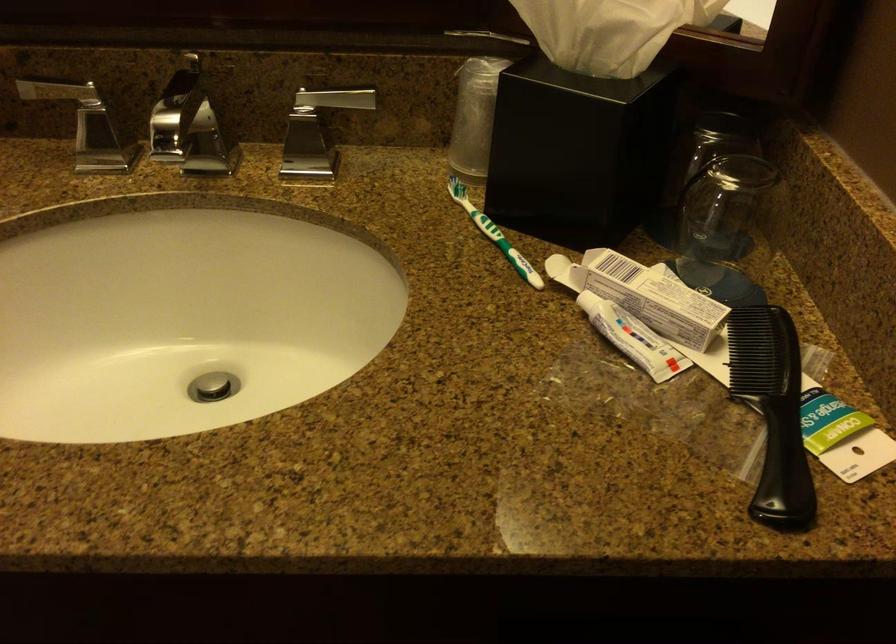
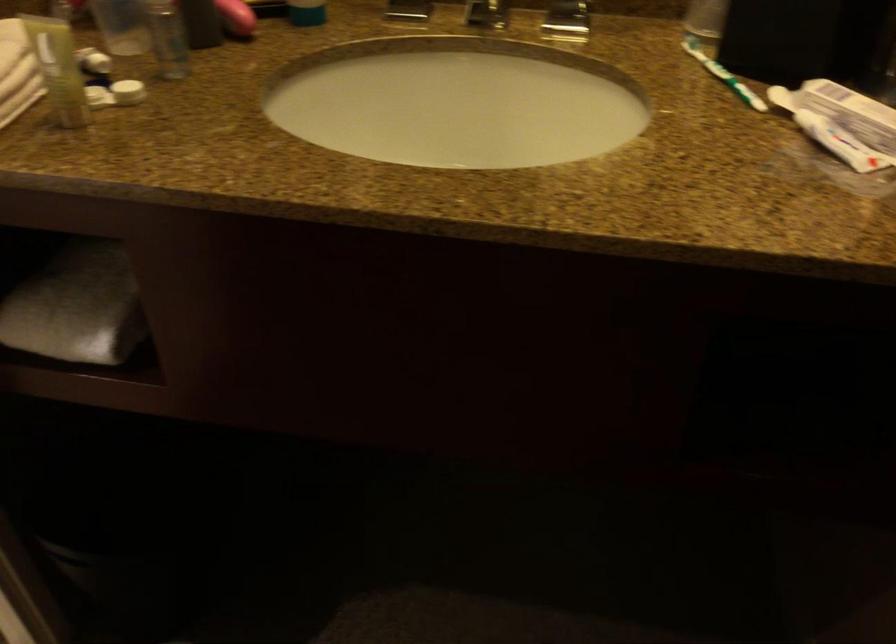
In the second image, find the point that corresponds to point (183, 269) in the first image.

(457, 102)